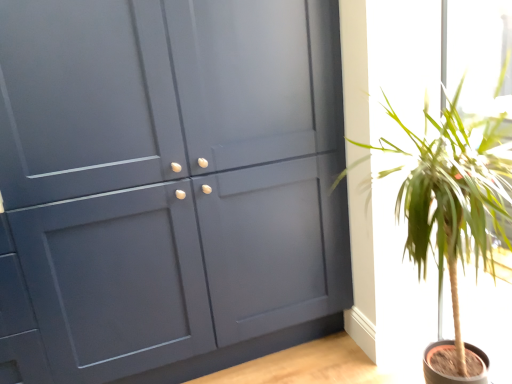
Question: Does matte gray cabinet at center have a smaller size compared to green leafy plant at right?

Choices:
 (A) no
 (B) yes

Answer: (A)

Question: Is the position of matte gray cabinet at center less distant than that of green leafy plant at right?

Choices:
 (A) no
 (B) yes

Answer: (A)

Question: Is matte gray cabinet at center taller than green leafy plant at right?

Choices:
 (A) yes
 (B) no

Answer: (A)

Question: From the image's perspective, would you say matte gray cabinet at center is positioned over green leafy plant at right?

Choices:
 (A) yes
 (B) no

Answer: (A)

Question: From a real-world perspective, is matte gray cabinet at center on top of green leafy plant at right?

Choices:
 (A) no
 (B) yes

Answer: (B)

Question: From the image's perspective, is matte gray cabinet at center located beneath green leafy plant at right?

Choices:
 (A) no
 (B) yes

Answer: (A)

Question: Is green leafy plant at right located outside matte gray cabinet at center?

Choices:
 (A) no
 (B) yes

Answer: (B)

Question: From a real-world perspective, is green leafy plant at right beneath matte gray cabinet at center?

Choices:
 (A) no
 (B) yes

Answer: (B)

Question: Considering the relative sizes of green leafy plant at right and matte gray cabinet at center in the image provided, is green leafy plant at right thinner than matte gray cabinet at center?

Choices:
 (A) yes
 (B) no

Answer: (A)

Question: From a real-world perspective, is green leafy plant at right on top of matte gray cabinet at center?

Choices:
 (A) no
 (B) yes

Answer: (A)

Question: Are green leafy plant at right and matte gray cabinet at center making contact?

Choices:
 (A) no
 (B) yes

Answer: (A)

Question: Can you confirm if green leafy plant at right is smaller than matte gray cabinet at center?

Choices:
 (A) yes
 (B) no

Answer: (A)

Question: Is matte gray cabinet at center taller or shorter than green leafy plant at right?

Choices:
 (A) short
 (B) tall

Answer: (B)